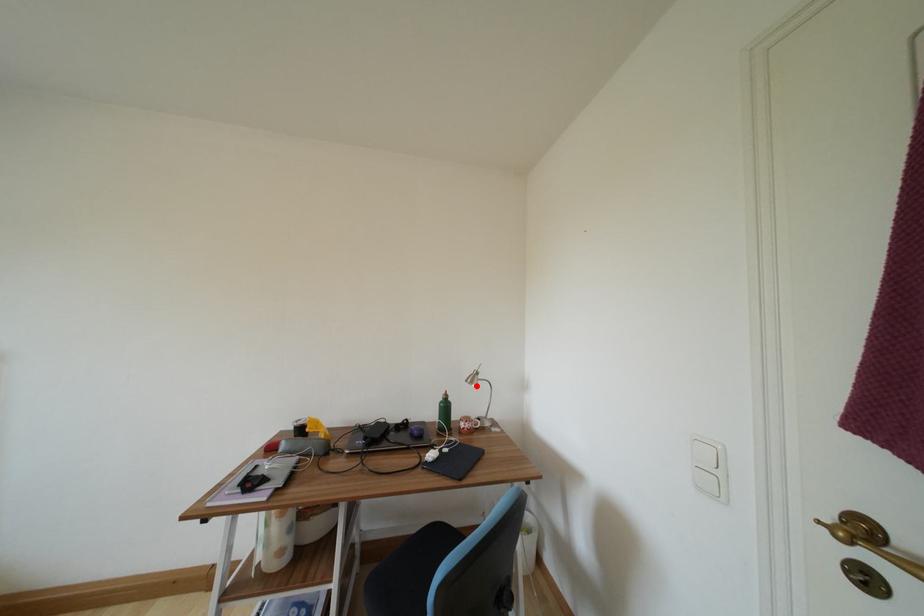
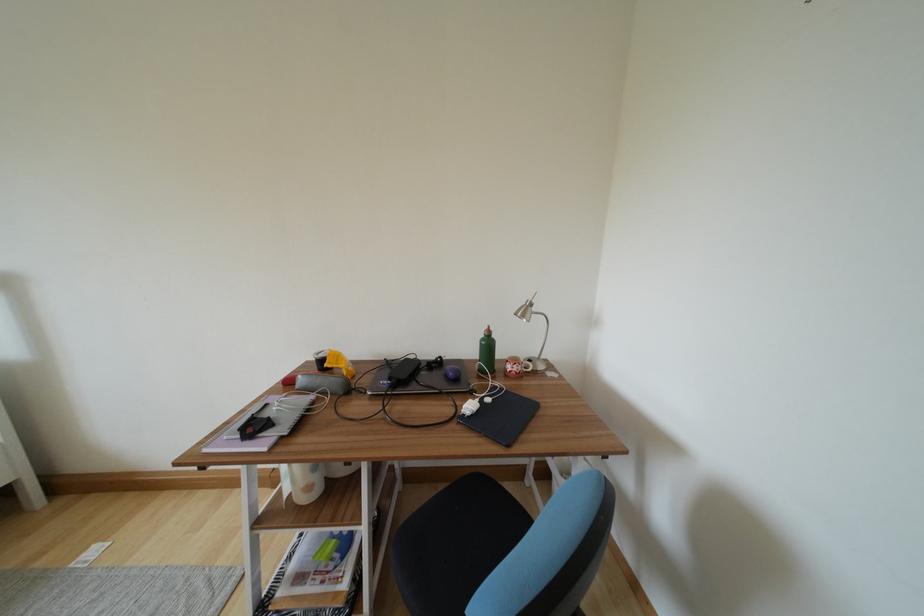
Locate, in the second image, the point that corresponds to the highlighted location in the first image.

(528, 320)